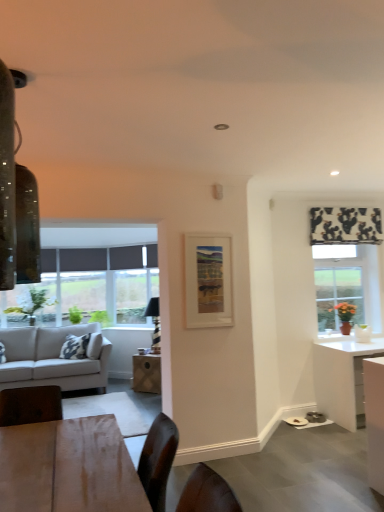
Question: Does white glossy desk at right have a lesser height compared to light gray fabric couch at left?

Choices:
 (A) yes
 (B) no

Answer: (A)

Question: Considering the relative sizes of white glossy desk at right and light gray fabric couch at left in the image provided, is white glossy desk at right bigger than light gray fabric couch at left?

Choices:
 (A) yes
 (B) no

Answer: (B)

Question: Considering the relative sizes of white glossy desk at right and light gray fabric couch at left in the image provided, is white glossy desk at right wider than light gray fabric couch at left?

Choices:
 (A) no
 (B) yes

Answer: (A)

Question: Does white glossy desk at right lie behind light gray fabric couch at left?

Choices:
 (A) yes
 (B) no

Answer: (B)

Question: Can we say white glossy desk at right lies outside light gray fabric couch at left?

Choices:
 (A) yes
 (B) no

Answer: (A)

Question: Relative to black and white fabric at upper right, is light gray fabric couch at left in front or behind?

Choices:
 (A) behind
 (B) front

Answer: (A)

Question: From a real-world perspective, is light gray fabric couch at left above or below black and white fabric at upper right?

Choices:
 (A) above
 (B) below

Answer: (B)

Question: In the image, is light gray fabric couch at left on the left side or the right side of black and white fabric at upper right?

Choices:
 (A) right
 (B) left

Answer: (B)

Question: Considering the positions of light gray fabric couch at left and black and white fabric at upper right in the image, is light gray fabric couch at left wider or thinner than black and white fabric at upper right?

Choices:
 (A) thin
 (B) wide

Answer: (B)

Question: Looking at their shapes, would you say matte wooden picture frame at center is wider or thinner than light gray fabric couch at left?

Choices:
 (A) wide
 (B) thin

Answer: (B)

Question: Considering the relative positions of matte wooden picture frame at center and light gray fabric couch at left in the image provided, is matte wooden picture frame at center to the left or to the right of light gray fabric couch at left?

Choices:
 (A) right
 (B) left

Answer: (A)

Question: Relative to light gray fabric couch at left, is matte wooden picture frame at center in front or behind?

Choices:
 (A) front
 (B) behind

Answer: (A)

Question: Looking at the image, does matte wooden picture frame at center seem bigger or smaller compared to light gray fabric couch at left?

Choices:
 (A) small
 (B) big

Answer: (A)

Question: Is black and white fabric at upper right in front of or behind wooden table at center in the image?

Choices:
 (A) front
 (B) behind

Answer: (A)

Question: From a real-world perspective, relative to wooden table at center, is black and white fabric at upper right vertically above or below?

Choices:
 (A) below
 (B) above

Answer: (B)